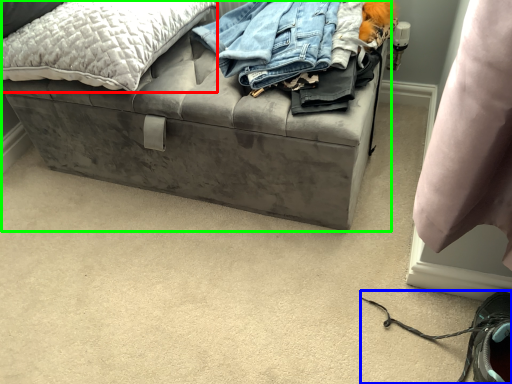
Question: Estimate the real-world distances between objects in this image. Which object is closer to pillow (highlighted by a red box), shoe (highlighted by a blue box) or furniture (highlighted by a green box)?

Choices:
 (A) shoe
 (B) furniture

Answer: (B)